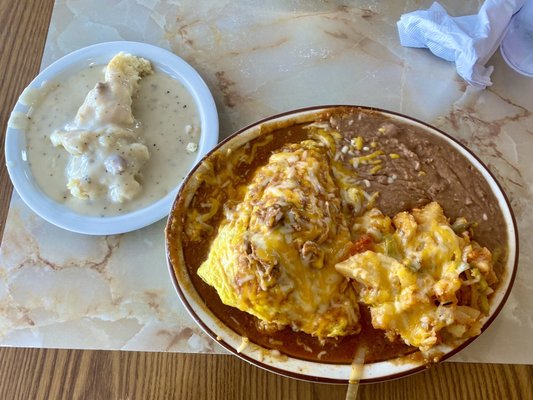
I want to click on plate, so click(175, 265).